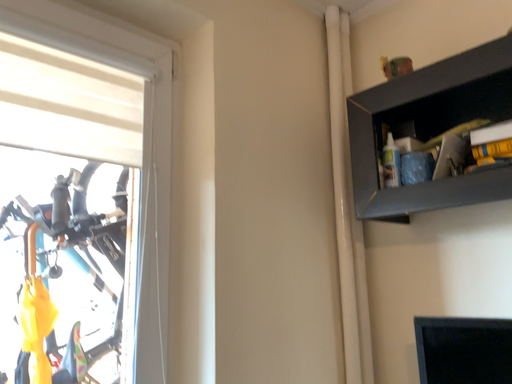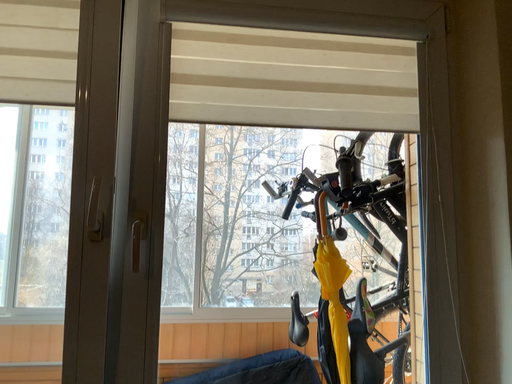
Question: How did the camera likely rotate when shooting the video?

Choices:
 (A) rotated left
 (B) rotated right

Answer: (A)